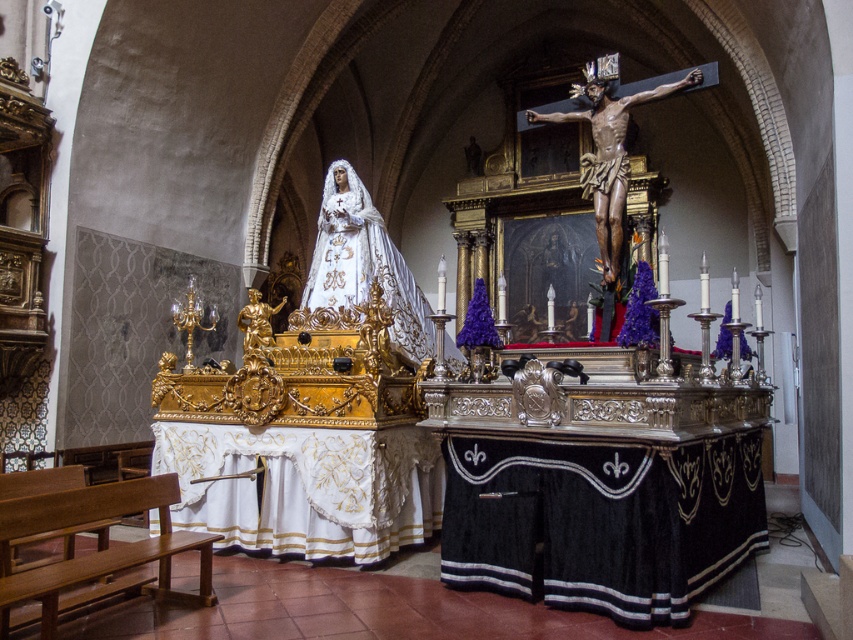
You are a visitor entering the church and see the wooden bench at lower left and the polished bronze crucifix at center. Which object is closer to the entrance of the church?

The wooden bench at lower left is positioned on the left side of the polished bronze crucifix at center, so it is closer to the entrance of the church.

You are attending a religious ceremony in the church and need to sit down. There is a wooden bench at lower left and a white satin statue at center. Which object should you approach to find a place to sit?

You should approach the wooden bench at lower left to sit, as it is positioned under the white satin statue at center, indicating it is a seating area.